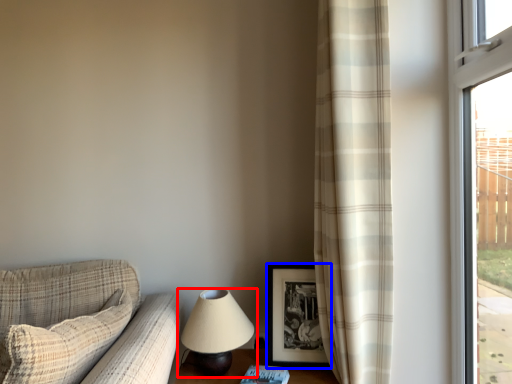
Question: Which of the following is the closest to the observer, lamp (highlighted by a red box) or picture frame (highlighted by a blue box)?

Choices:
 (A) lamp
 (B) picture frame

Answer: (A)